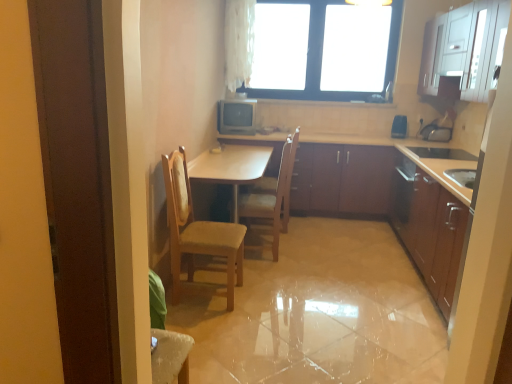
Question: Visually, is wooden at center, marked as the 1th chair in a back-to-front arrangement, positioned to the left or to the right of light brown wood table at center?

Choices:
 (A) left
 (B) right

Answer: (B)

Question: Relative to light brown wood table at center, is wooden at center, the 2th chair in the front-to-back sequence, in front or behind?

Choices:
 (A) behind
 (B) front

Answer: (A)

Question: Which is farther from the wooden at center, marked as the 1th chair in a back-to-front arrangement?

Choices:
 (A) matte brown cabinets at center, which appears as the second cabinetry when viewed from the top
 (B) wooden cabinets at right, the 4th cabinetry positioned from the top
 (C) black glass window at upper center
 (D) light brown wood table at center
 (E) wooden chair at center, which is counted as the first chair, starting from the front

Answer: (C)

Question: Based on their relative distances, which object is farther from the white sheer curtain at upper center?

Choices:
 (A) metallic silver television at center, the second appliance in the right-to-left sequence
 (B) black glass window at upper center
 (C) matte brown cabinets at center, which appears as the second cabinetry when viewed from the top
 (D) white glossy cabinet at upper right, arranged as the fourth cabinetry when ordered from the bottom
 (E) blue plastic speaker at upper right, arranged as the 2th appliance when viewed from the left

Answer: (D)